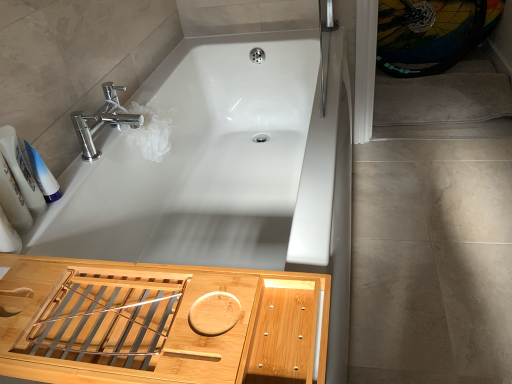
This screenshot has width=512, height=384. Find the location of `blank space situated above beige tile floor at lower right (from a real-world perspective)`. blank space situated above beige tile floor at lower right (from a real-world perspective) is located at coordinates (429, 244).